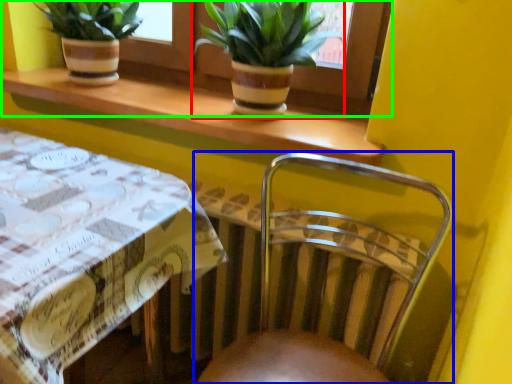
Question: Estimate the real-world distances between objects in this image. Which object is closer to houseplant (highlighted by a red box), chair (highlighted by a blue box) or window frame (highlighted by a green box)?

Choices:
 (A) chair
 (B) window frame

Answer: (B)